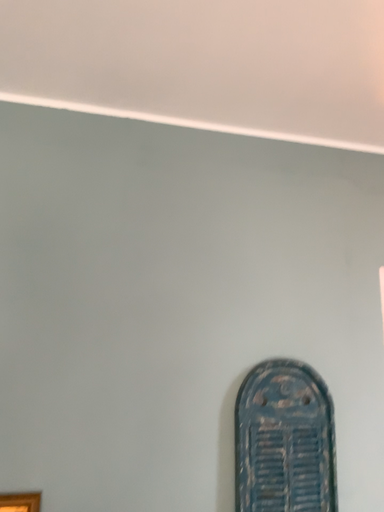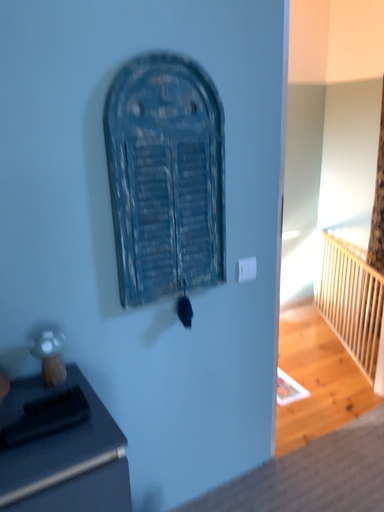
Question: Which way did the camera rotate in the video?

Choices:
 (A) rotated downward
 (B) rotated upward

Answer: (A)